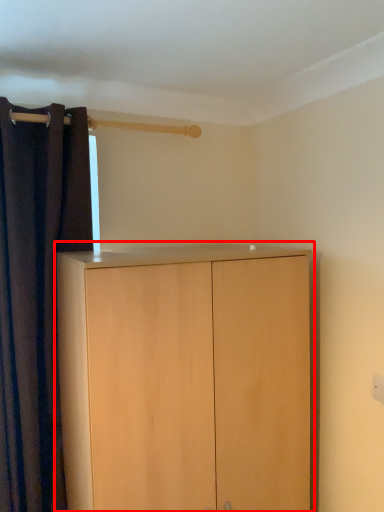
Question: From the image, what is the correct spatial relationship of cupboard (annotated by the red box) in relation to curtain?

Choices:
 (A) right
 (B) left

Answer: (A)